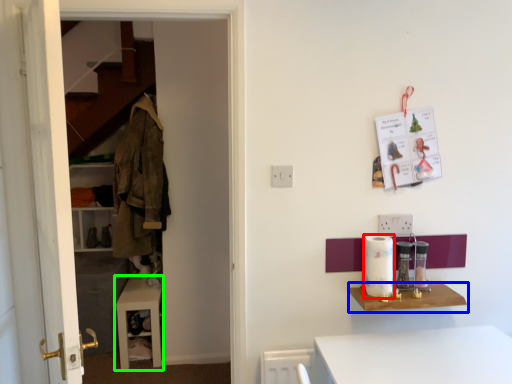
Question: Which object is positioned closest to appliance (highlighted by a red box)? Select from shelf (highlighted by a blue box) and table (highlighted by a green box).

Choices:
 (A) shelf
 (B) table

Answer: (A)